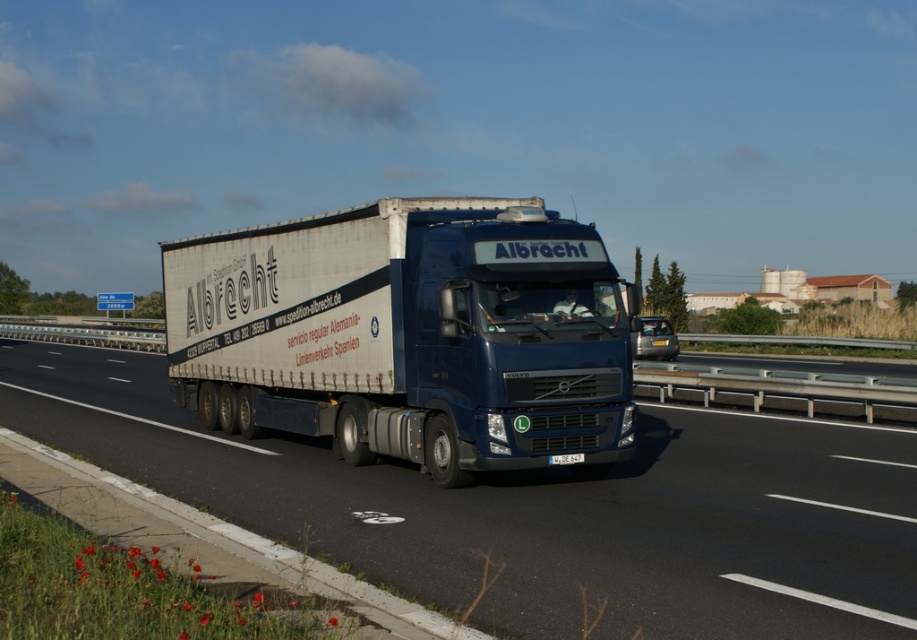
Is white matte truck at center closer to camera compared to matte blue truck at center?

Yes, it is.

Which is below, white matte truck at center or matte blue truck at center?

white matte truck at center is below.

Is point (792, 554) closer to viewer compared to point (537, 317)?

Yes, point (792, 554) is closer to viewer.

At what (x,y) coordinates should I click in order to perform the action: click on white matte truck at center. Please return your answer as a coordinate pair (x, y). The height and width of the screenshot is (640, 917). Looking at the image, I should click on (538, 512).